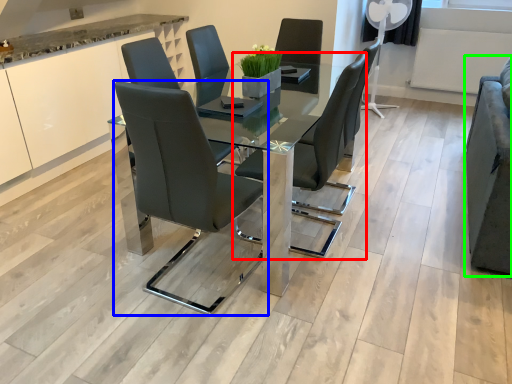
Question: Estimate the real-world distances between objects in this image. Which object is farther from chair (highlighted by a red box), chair (highlighted by a blue box) or armchair (highlighted by a green box)?

Choices:
 (A) chair
 (B) armchair

Answer: (B)